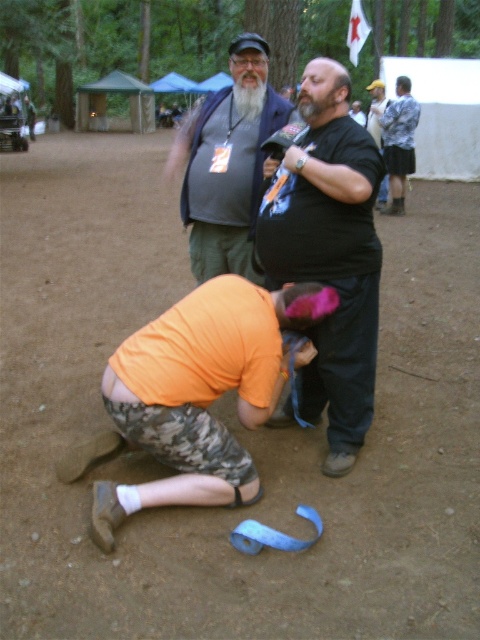
From the picture: You are standing at the edge of the campsite and see the orange fabric at lower center and the matte gray vest at center. Which object is closer to the ground?

The orange fabric at lower center is shorter than the matte gray vest at center, so it is closer to the ground.

You are standing at the campsite and want to reach the point marked as point [268,328]. If you take a step forward, will you be closer to or farther from that point?

Since the distance between point [268,328] and the viewer is 8.50 feet, taking a step forward would decrease the distance, so you would be closer to point [268,328].

You are a photographer positioned at the edge of the campsite. You want to capture a photo of the black matte shirt at center and the matte gray vest at center. If your camera has a depth of field that can clearly focus on objects within 5 feet of each other, will both subjects be in focus?

The distance between the black matte shirt at center and matte gray vest at center is 6.64 feet. Since the camera can only focus on objects within 5 feet of each other, the two subjects are too far apart to both be in focus simultaneously.